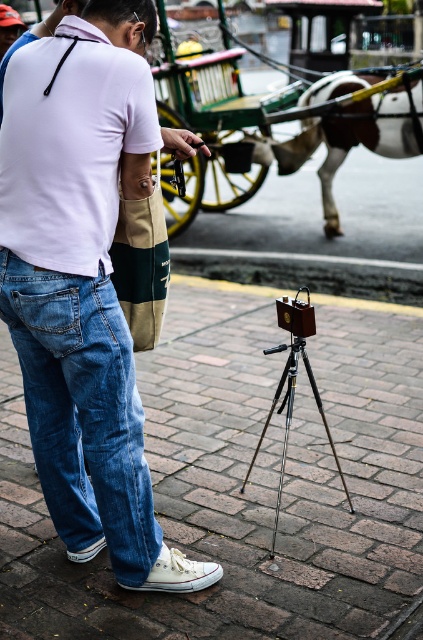
Can you confirm if brick pavement at center is bigger than denim jeans at lower left?

Yes.

Between brick pavement at center and denim jeans at lower left, which one is positioned higher?

denim jeans at lower left is higher up.

Locate an element on the screen. The width and height of the screenshot is (423, 640). brick pavement at center is located at coordinates (247, 484).

At what (x,y) coordinates should I click in order to perform the action: click on brick pavement at center. Please return your answer as a coordinate pair (x, y). The image size is (423, 640). Looking at the image, I should click on (247, 484).

Does blue denim jeans at lower left have a lesser height compared to white glossy horse at upper center?

Yes.

Can you confirm if blue denim jeans at lower left is positioned above white glossy horse at upper center?

No.

This screenshot has width=423, height=640. What do you see at coordinates (82, 410) in the screenshot?
I see `blue denim jeans at lower left` at bounding box center [82, 410].

Image resolution: width=423 pixels, height=640 pixels. I want to click on blue denim jeans at lower left, so click(x=82, y=410).

Who is higher up, brick pavement at center or metallic tripod at center?

Positioned higher is metallic tripod at center.

Is brick pavement at center to the left of metallic tripod at center from the viewer's perspective?

Yes, brick pavement at center is to the left of metallic tripod at center.

Who is more distant from viewer, (266, 371) or (250, 468)?

Positioned behind is point (266, 371).

Where is `brick pavement at center`? The image size is (423, 640). brick pavement at center is located at coordinates (247, 484).